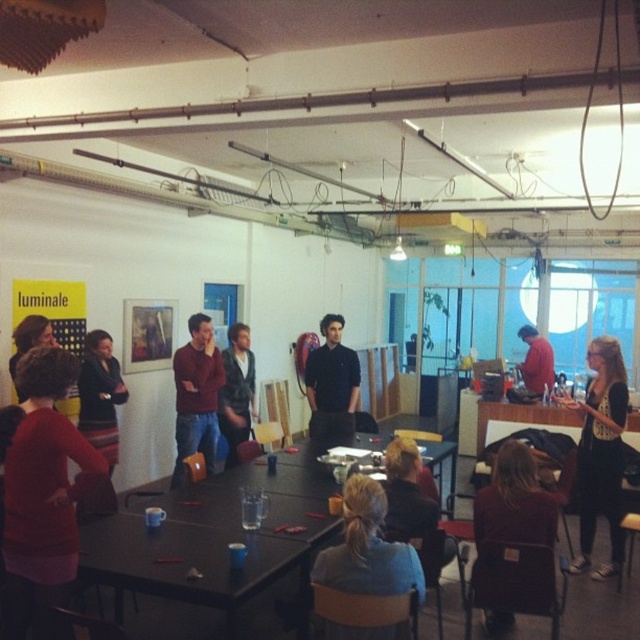
Question: Which of the following is the farthest from the observer?

Choices:
 (A) (394, 513)
 (B) (310, 403)

Answer: (B)

Question: Which point is closer to the camera taking this photo?

Choices:
 (A) (19, 573)
 (B) (99, 381)
 (C) (116, 576)

Answer: (A)

Question: Can you confirm if black glossy table at center is positioned to the left of light blue shirt at center?

Choices:
 (A) yes
 (B) no

Answer: (A)

Question: Which point is farther to the camera?

Choices:
 (A) (108, 368)
 (B) (627, 525)

Answer: (A)

Question: Does black glossy table at center lie in front of black smooth shirt at center?

Choices:
 (A) no
 (B) yes

Answer: (B)

Question: Can you confirm if matte red dress at lower left is positioned to the right of maroon fabric jacket at lower right?

Choices:
 (A) no
 (B) yes

Answer: (A)